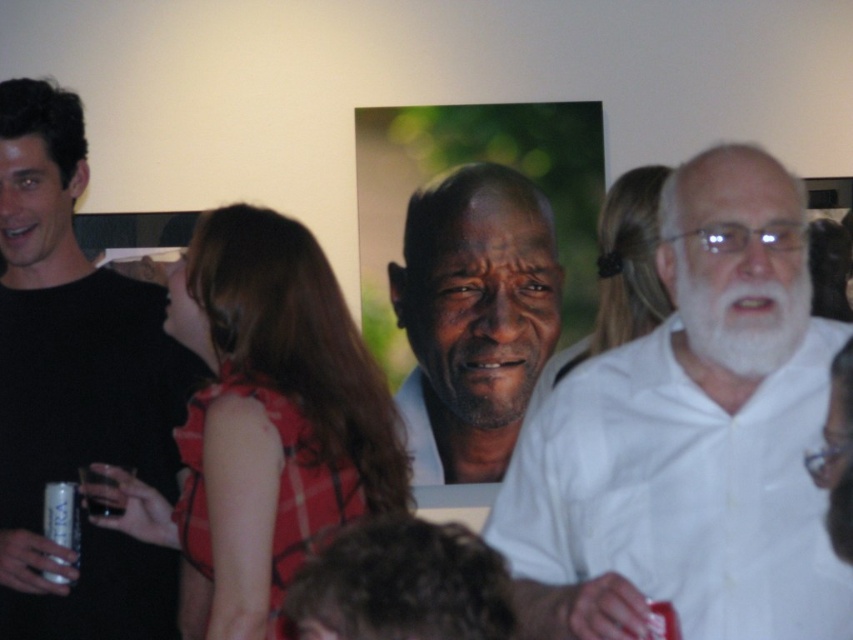
Who is higher up, white matte shirt at right or black matte shirt at left?

black matte shirt at left is above.

This screenshot has width=853, height=640. What do you see at coordinates (689, 438) in the screenshot? I see `white matte shirt at right` at bounding box center [689, 438].

Where is `white matte shirt at right`? white matte shirt at right is located at coordinates (689, 438).

This screenshot has height=640, width=853. In order to click on whitehairbeard at right in this screenshot , I will do `click(741, 317)`.

Is point (685, 326) behind point (497, 381)?

That is False.

Who is more forward, [802,276] or [523,376]?

Point [802,276] is more forward.

Where is `whitehairbeard at right`? This screenshot has width=853, height=640. whitehairbeard at right is located at coordinates pyautogui.click(x=741, y=317).

Who is more forward, (445,250) or (502,339)?

Point (502,339) is in front.

Who is higher up, matte white face at center or gray matte beard at center?

matte white face at center is higher up.

Is point (521, 310) positioned in front of point (460, 340)?

No, (521, 310) is further to viewer.

Find the location of a particular element. The height and width of the screenshot is (640, 853). matte white face at center is located at coordinates (473, 317).